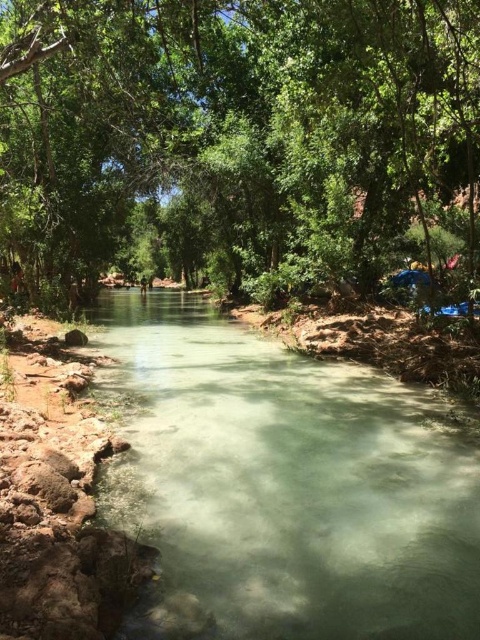
You are a hiker who wants to cross the stream. You see the green leafy tree at center and the clear water at center. How far apart are these two landmarks?

The green leafy tree at center and the clear water at center are 10.52 meters apart from each other.

You are standing at the edge of the stream and want to reach the green leafy tree at center. Which direction should you head towards from your current position?

The green leafy tree at center is located at point (237, 144), so you should head towards the center of the image from the edge of the stream to reach it.

You are standing on the bank of the stream and want to take a photo of the green leafy tree at center and the clear water at center. Which object is positioned to the left of the other?

The green leafy tree at center is to the left of the clear water at center.